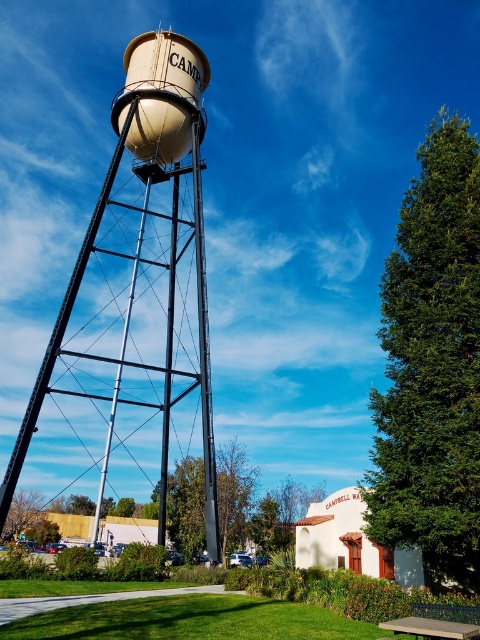
Is matte beige water tower at center wider than beige matte water tower at upper center?

Yes, matte beige water tower at center is wider than beige matte water tower at upper center.

Who is more distant from viewer, (x=110, y=323) or (x=158, y=42)?

Positioned behind is point (x=110, y=323).

Identify the location of matte beige water tower at center. (133, 305).

Is matte beige water tower at center thinner than concrete bench at lower right?

No.

Is point (91, 362) closer to viewer compared to point (479, 611)?

No.

Where is `matte beige water tower at center`? matte beige water tower at center is located at coordinates (133, 305).

Does beige matte water tower at upper center appear on the right side of concrete bench at lower right?

Incorrect, beige matte water tower at upper center is not on the right side of concrete bench at lower right.

This screenshot has width=480, height=640. What are the coordinates of `beige matte water tower at upper center` in the screenshot? It's located at (160, 93).